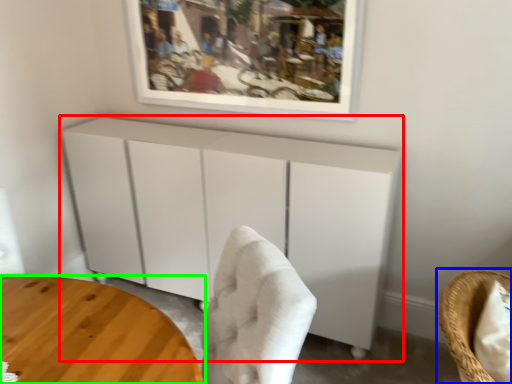
Question: Which is nearer to the cabinetry (highlighted by a red box)? chair (highlighted by a blue box) or table (highlighted by a green box).

Choices:
 (A) chair
 (B) table

Answer: (B)